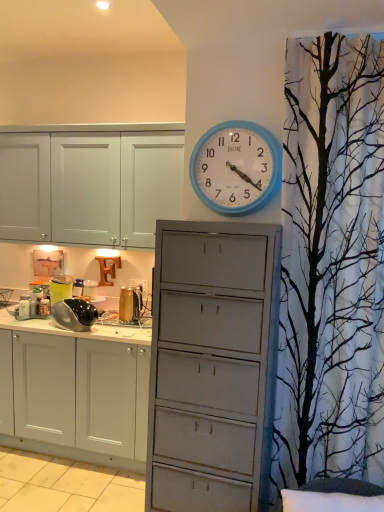
Where is `vacant area that lies in front of gold metallic kettle at center, placed as the 3th appliance when sorted from left to right`? This screenshot has width=384, height=512. vacant area that lies in front of gold metallic kettle at center, placed as the 3th appliance when sorted from left to right is located at coordinates (124, 333).